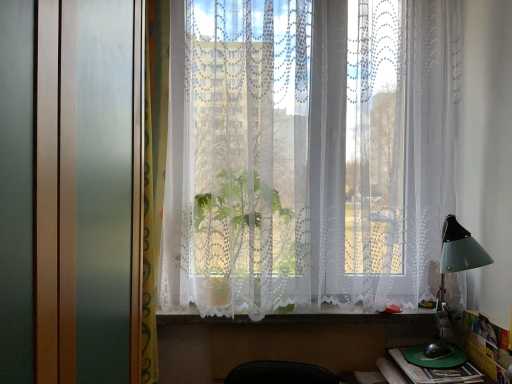
Describe the element at coordinates (308, 153) in the screenshot. The height and width of the screenshot is (384, 512). I see `white lace curtains at center` at that location.

In order to face green patterned curtain at left, should I rotate leftwards or rightwards?

Turn left approximately 13.483 degrees to face it.

The width and height of the screenshot is (512, 384). What are the coordinates of `green patterned curtain at left` in the screenshot? It's located at coord(154,171).

The image size is (512, 384). What do you see at coordinates (436, 356) in the screenshot?
I see `green plastic plate at lower right` at bounding box center [436, 356].

Where is `green plastic plate at lower right`? This screenshot has width=512, height=384. green plastic plate at lower right is located at coordinates (436, 356).

You are a GUI agent. You are given a task and a screenshot of the screen. Output one action in this format:
    pyautogui.click(x=<x>, y=<y>)
    Task: Click on the white lace curtain at lower center
    
    Given the screenshot: What is the action you would take?
    pyautogui.click(x=351, y=316)

You are a GUI agent. You are given a task and a screenshot of the screen. Output one action in this format:
    pyautogui.click(x=<x>, y=<y>)
    Task: Click on the white lace curtains at center
    The height and width of the screenshot is (384, 512).
    Given the screenshot: What is the action you would take?
    pyautogui.click(x=308, y=153)

In terms of height, does green plastic book at lower right look taller or shorter compared to green patterned curtain at left?

green plastic book at lower right is shorter than green patterned curtain at left.

Is point (451, 370) closer or farther from the camera than point (144, 196)?

Point (451, 370) appears to be farther away from the viewer than point (144, 196).

From the picture: Considering the relative positions of green plastic book at lower right and green patterned curtain at left in the image provided, is green plastic book at lower right to the left or to the right of green patterned curtain at left?

In the image, green plastic book at lower right appears on the right side of green patterned curtain at left.

Considering the relative sizes of green plastic book at lower right and green patterned curtain at left in the image provided, is green plastic book at lower right thinner than green patterned curtain at left?

No.

Does green patterned curtain at left appear on the left side of green plastic book at lower right?

Correct, you'll find green patterned curtain at left to the left of green plastic book at lower right.

From a real-world perspective, is green patterned curtain at left physically above green plastic book at lower right?

Yes, from a real-world perspective, green patterned curtain at left is over green plastic book at lower right

Which is more to the right, green plastic plate at lower right or white lace curtain at lower center?

From the viewer's perspective, green plastic plate at lower right appears more on the right side.

Are green plastic plate at lower right and white lace curtain at lower center far apart?

No, green plastic plate at lower right is not far from white lace curtain at lower center.

How far apart are green plastic plate at lower right and white lace curtain at lower center?

The distance of green plastic plate at lower right from white lace curtain at lower center is 11.97 inches.

Can you confirm if white lace curtains at center is thinner than green plastic plate at lower right?

In fact, white lace curtains at center might be wider than green plastic plate at lower right.

From the picture: Is white lace curtains at center to the right of green plastic plate at lower right from the viewer's perspective?

In fact, white lace curtains at center is to the left of green plastic plate at lower right.

From the image's perspective, who appears lower, white lace curtains at center or green plastic plate at lower right?

green plastic plate at lower right is shown below in the image.

From a real-world perspective, which object stands above the other?

white lace curtains at center is physically above.

From the image's perspective, relative to white lace curtain at lower center, is white lace curtains at center above or below?

Based on their image positions, white lace curtains at center is located above white lace curtain at lower center.

The height and width of the screenshot is (384, 512). Identify the location of window sill that appears behind the white lace curtains at center. click(x=351, y=316).

In terms of width, does white lace curtains at center look wider or thinner when compared to white lace curtain at lower center?

white lace curtains at center is wider than white lace curtain at lower center.

Is the position of white lace curtains at center more distant than that of white lace curtain at lower center?

No, white lace curtains at center is in front of white lace curtain at lower center.

In terms of size, does white lace curtains at center appear bigger or smaller than green patterned curtain at left?

Considering their sizes, white lace curtains at center takes up more space than green patterned curtain at left.

Between white lace curtains at center and green patterned curtain at left, which one has larger width?

With larger width is white lace curtains at center.

Which is farther from the camera, (320, 62) or (159, 193)?

The point (320, 62) is behind.

From a real-world perspective, between white lace curtains at center and green patterned curtain at left, who is vertically higher?

white lace curtains at center is physically above.

Considering the relative positions of green plastic book at lower right and green plastic plate at lower right in the image provided, is green plastic book at lower right to the right of green plastic plate at lower right from the viewer's perspective?

Incorrect, green plastic book at lower right is not on the right side of green plastic plate at lower right.

Is green plastic book at lower right aimed at green plastic plate at lower right?

No, green plastic book at lower right is not turned towards green plastic plate at lower right.

Can you confirm if green plastic book at lower right is smaller than green plastic plate at lower right?

No, green plastic book at lower right is not smaller than green plastic plate at lower right.

Is green plastic book at lower right in contact with green plastic plate at lower right?

Yes, green plastic book at lower right and green plastic plate at lower right clearly make contact.

Where is `curtain that is above the green plastic book at lower right (from a real-world perspective)`? This screenshot has width=512, height=384. curtain that is above the green plastic book at lower right (from a real-world perspective) is located at coordinates (154, 171).

You are a GUI agent. You are given a task and a screenshot of the screen. Output one action in this format:
    pyautogui.click(x=<x>, y=<y>)
    Task: Click on the book behind the green patterned curtain at left
    
    Given the screenshot: What is the action you would take?
    pyautogui.click(x=435, y=371)

Estimate the real-world distances between objects in this image. Which object is closer to green patterned curtain at left, green plastic plate at lower right or white lace curtains at center?

Among the two, white lace curtains at center is located nearer to green patterned curtain at left.

Considering their positions, is white lace curtains at center positioned further to green plastic book at lower right than green plastic plate at lower right?

Based on the image, white lace curtains at center appears to be further to green plastic book at lower right.

When comparing their distances from green plastic book at lower right, does green plastic plate at lower right or white lace curtain at lower center seem further?

Among the two, white lace curtain at lower center is located further to green plastic book at lower right.

Based on their spatial positions, is green patterned curtain at left or green plastic plate at lower right further from green plastic book at lower right?

The object further to green plastic book at lower right is green patterned curtain at left.

Considering their positions, is white lace curtains at center positioned further to green plastic book at lower right than white lace curtain at lower center?

white lace curtains at center lies further to green plastic book at lower right than the other object.

Estimate the real-world distances between objects in this image. Which object is closer to white lace curtains at center, green plastic plate at lower right or green patterned curtain at left?

Based on the image, green patterned curtain at left appears to be nearer to white lace curtains at center.

Based on their spatial positions, is green plastic plate at lower right or green patterned curtain at left closer to green plastic book at lower right?

green plastic plate at lower right lies closer to green plastic book at lower right than the other object.

Which object lies further to the anchor point green plastic plate at lower right, white lace curtains at center or white lace curtain at lower center?

Among the two, white lace curtains at center is located further to green plastic plate at lower right.

Locate an element on the screen. This screenshot has height=384, width=512. window sill between white lace curtains at center and green plastic book at lower right in the vertical direction is located at coordinates (351, 316).

The height and width of the screenshot is (384, 512). Identify the location of window sill located between green patterned curtain at left and green plastic plate at lower right in the left-right direction. (351, 316).

Find the location of a particular element. The width and height of the screenshot is (512, 384). round table between white lace curtains at center and green plastic book at lower right vertically is located at coordinates (436, 356).

Where is `window sill between white lace curtains at center and green plastic plate at lower right in the vertical direction`? This screenshot has width=512, height=384. window sill between white lace curtains at center and green plastic plate at lower right in the vertical direction is located at coordinates (351, 316).